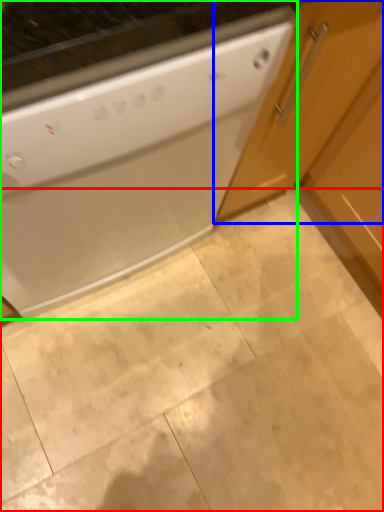
Question: Based on their relative distances, which object is nearer to granite (highlighted by a red box)? Choose from cabinetry (highlighted by a blue box) and home appliance (highlighted by a green box).

Choices:
 (A) cabinetry
 (B) home appliance

Answer: (B)